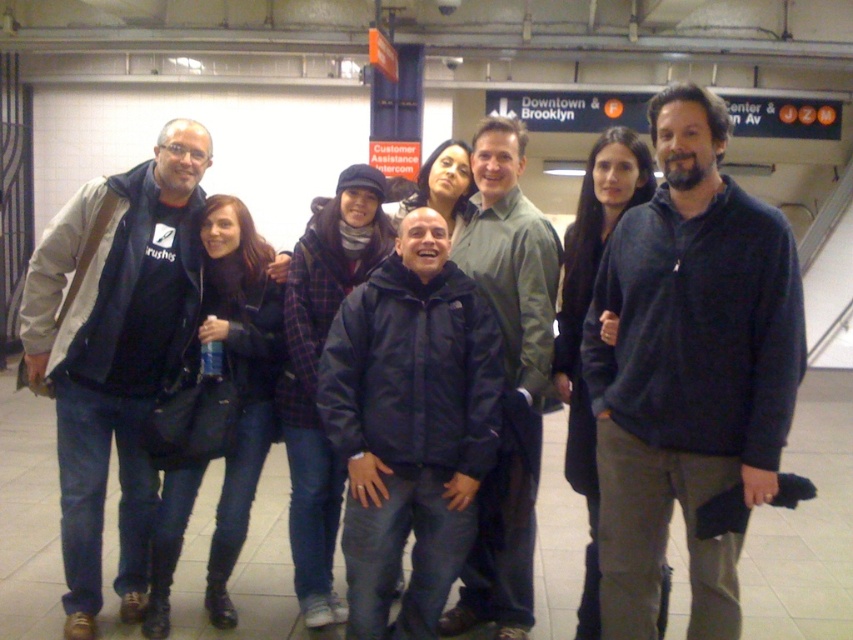
Question: Does dark blue fleece at center appear under navy blue jacket at center?

Choices:
 (A) yes
 (B) no

Answer: (B)

Question: Which point is closer to the camera taking this photo?

Choices:
 (A) (714, 612)
 (B) (508, 554)
 (C) (360, 600)
 (D) (68, 572)

Answer: (A)

Question: Observing the image, what is the correct spatial positioning of dark blue fleece at center in reference to brushed metal jacket at left?

Choices:
 (A) above
 (B) below

Answer: (A)

Question: Is dark blue fleece at center below navy blue jacket at center?

Choices:
 (A) yes
 (B) no

Answer: (B)

Question: Which of the following is the farthest from the observer?

Choices:
 (A) dark blue jacket at center
 (B) dark blue fleece at center

Answer: (A)

Question: Estimate the real-world distances between objects in this image. Which object is farther from the brushed metal jacket at left?

Choices:
 (A) navy blue jacket at center
 (B) dark blue jacket at center
 (C) dark blue fleece at center

Answer: (C)